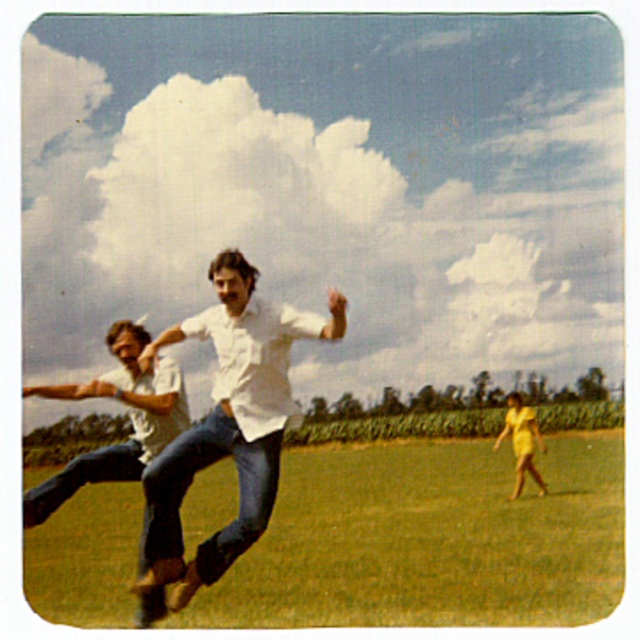
Question: Does denim jeans at center appear under light brown denim pants at left?

Choices:
 (A) yes
 (B) no

Answer: (A)

Question: Does green grass at center have a smaller size compared to light brown denim pants at left?

Choices:
 (A) no
 (B) yes

Answer: (A)

Question: Considering the real-world distances, which object is closest to the yellow satin dress at lower right?

Choices:
 (A) green grass at center
 (B) light brown denim pants at left
 (C) denim jeans at center
 (D) white cotton shirt at center

Answer: (A)

Question: Estimate the real-world distances between objects in this image. Which object is farther from the green grass at center?

Choices:
 (A) white cotton shirt at center
 (B) light brown denim pants at left
 (C) denim jeans at center

Answer: (C)

Question: Which of the following is the farthest from the observer?

Choices:
 (A) (200, 440)
 (B) (272, 330)
 (C) (515, 452)
 (D) (209, 596)

Answer: (C)

Question: Is light brown denim pants at left smaller than yellow satin dress at lower right?

Choices:
 (A) no
 (B) yes

Answer: (B)